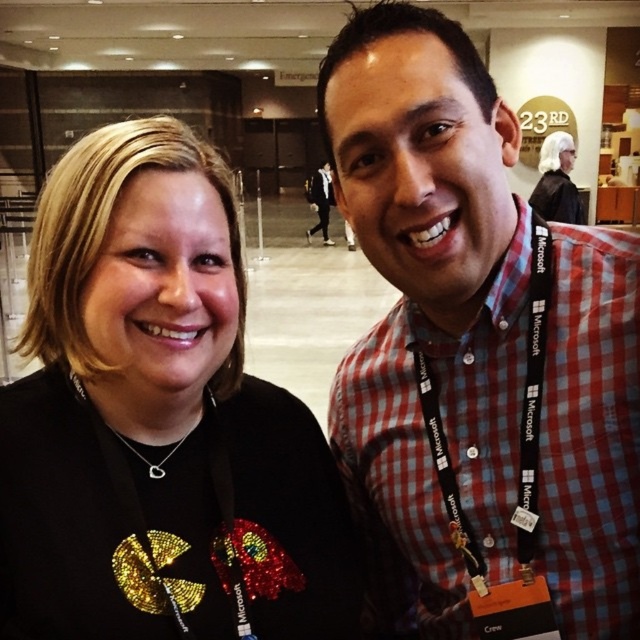
Who is lower down, black sequined shirt at center or white hair wig at upper center?

black sequined shirt at center is lower down.

Is black sequined shirt at center above white hair wig at upper center?

Incorrect, black sequined shirt at center is not positioned above white hair wig at upper center.

Who is more distant from viewer, (20, 452) or (550, 172)?

Positioned behind is point (550, 172).

This screenshot has width=640, height=640. I want to click on black sequined shirt at center, so click(x=157, y=420).

Who is shorter, black fabric lanyard at center or white hair wig at upper center?

black fabric lanyard at center is shorter.

Where is `black fabric lanyard at center`? This screenshot has height=640, width=640. black fabric lanyard at center is located at coordinates (132, 496).

Locate an element on the screen. This screenshot has width=640, height=640. black fabric lanyard at center is located at coordinates (132, 496).

Who is more forward, (568, 294) or (556, 145)?

Point (568, 294) is more forward.

Is point (401, 579) behind point (576, 216)?

No, (401, 579) is closer to viewer.

Identify the location of red checkered shirt at right. The width and height of the screenshot is (640, 640). (429, 448).